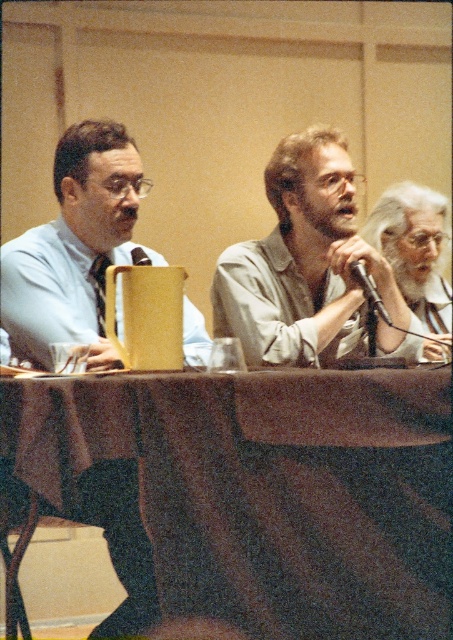
Question: Which object is farther from the camera taking this photo?

Choices:
 (A) matte black shirt at left
 (B) yellow matte microphone at center
 (C) brown fabric table at center
 (D) white hair at upper right

Answer: (B)

Question: Can you confirm if light gray shirt at center is positioned below yellow matte microphone at center?

Choices:
 (A) no
 (B) yes

Answer: (A)

Question: Is brown fabric table at center below metallic silver microphone at center?

Choices:
 (A) no
 (B) yes

Answer: (B)

Question: Which is farther from the light gray shirt at center?

Choices:
 (A) black silk tie at left
 (B) brown fabric table at center
 (C) matte black shirt at left

Answer: (B)

Question: In this image, where is brown fabric table at center located relative to matte black shirt at left?

Choices:
 (A) below
 (B) above

Answer: (A)

Question: Which object is the farthest from the yellow matte microphone at center?

Choices:
 (A) metallic silver microphone at center
 (B) matte black shirt at left
 (C) white hair at upper right

Answer: (C)